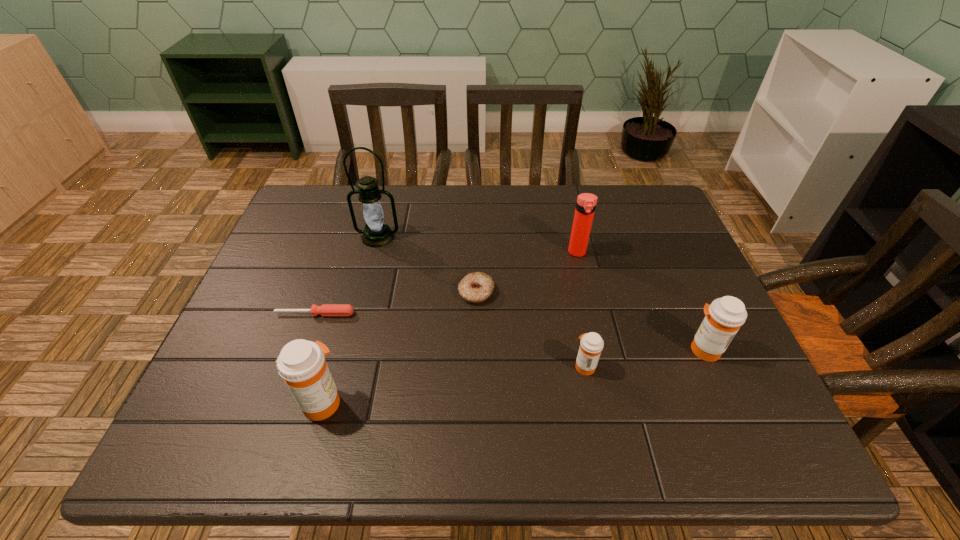
Identify the location of empty location between the doughnut and the nearest object. Image resolution: width=960 pixels, height=540 pixels. (399, 347).

This screenshot has width=960, height=540. Find the location of `vacant space in between the second medicine from left to right and the shortest object`. vacant space in between the second medicine from left to right and the shortest object is located at coordinates (450, 340).

This screenshot has height=540, width=960. I want to click on free area in between the screwdriver and the tallest object, so click(x=347, y=275).

In order to click on free area in between the lantern and the thermos bottle in this screenshot , I will do `click(477, 245)`.

At what (x,y) coordinates should I click in order to perform the action: click on free space that is in between the rightmost medicine and the leftmost medicine. Please return your answer as a coordinate pair (x, y). Looking at the image, I should click on (514, 376).

The width and height of the screenshot is (960, 540). I want to click on free space between the thermos bottle and the fourth shortest object, so click(x=640, y=301).

Locate an element on the screen. The width and height of the screenshot is (960, 540). vacant point located between the thermos bottle and the tallest object is located at coordinates (477, 245).

Identify which object is the sixth closest to the fourth farthest object. Please provide its 2D coordinates. Your answer should be formatted as a tuple, i.e. [(x, y)], where the tuple contains the x and y coordinates of a point satisfying the conditions above.

[(723, 318)]

Select which object is the fourth closest to the thermos bottle. Please provide its 2D coordinates. Your answer should be formatted as a tuple, i.e. [(x, y)], where the tuple contains the x and y coordinates of a point satisfying the conditions above.

[(377, 233)]

Identify the location of medicine that is the second closest to the rightmost object. The width and height of the screenshot is (960, 540). (301, 364).